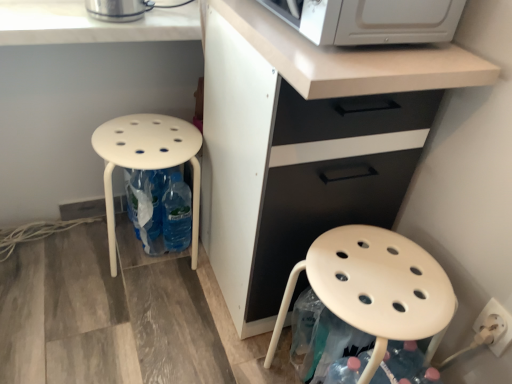
Question: Would you consider white matte cabinet at center to be distant from matte white stool at lower left, marked as the 1th stool in a right-to-left arrangement?

Choices:
 (A) no
 (B) yes

Answer: (A)

Question: Does white matte cabinet at center have a lesser height compared to matte white stool at lower left, acting as the second stool starting from the left?

Choices:
 (A) yes
 (B) no

Answer: (B)

Question: From a real-world perspective, is white matte cabinet at center over matte white stool at lower left, acting as the second stool starting from the left?

Choices:
 (A) yes
 (B) no

Answer: (A)

Question: Can you see white matte cabinet at center touching matte white stool at lower left, acting as the second stool starting from the left?

Choices:
 (A) yes
 (B) no

Answer: (B)

Question: Is white matte cabinet at center at the left side of matte white stool at lower left, marked as the 1th stool in a right-to-left arrangement?

Choices:
 (A) yes
 (B) no

Answer: (A)

Question: Would you say white plastic electric outlet at lower right is to the left or to the right of white marble countertop at upper left in the picture?

Choices:
 (A) left
 (B) right

Answer: (B)

Question: Is point (488, 299) positioned closer to the camera than point (103, 34)?

Choices:
 (A) farther
 (B) closer

Answer: (B)

Question: Considering the positions of white plastic electric outlet at lower right and white marble countertop at upper left in the image, is white plastic electric outlet at lower right wider or thinner than white marble countertop at upper left?

Choices:
 (A) thin
 (B) wide

Answer: (A)

Question: Choose the correct answer: Is white plastic electric outlet at lower right inside white marble countertop at upper left or outside it?

Choices:
 (A) outside
 (B) inside

Answer: (A)

Question: From the image's perspective, is white marble countertop at upper left located above or below white plastic electric outlet at lower right?

Choices:
 (A) above
 (B) below

Answer: (A)

Question: Based on their sizes in the image, would you say white marble countertop at upper left is bigger or smaller than white plastic electric outlet at lower right?

Choices:
 (A) small
 (B) big

Answer: (B)

Question: Would you say white marble countertop at upper left is inside or outside white plastic electric outlet at lower right?

Choices:
 (A) inside
 (B) outside

Answer: (B)

Question: From a real-world perspective, is white marble countertop at upper left physically located above or below white plastic electric outlet at lower right?

Choices:
 (A) above
 (B) below

Answer: (A)

Question: Choose the correct answer: Is white matte cabinet at center inside matte white stool at lower left, marked as the 1th stool in a right-to-left arrangement, or outside it?

Choices:
 (A) inside
 (B) outside

Answer: (B)

Question: Based on their positions, is white matte cabinet at center located to the left or right of matte white stool at lower left, marked as the 1th stool in a right-to-left arrangement?

Choices:
 (A) left
 (B) right

Answer: (A)